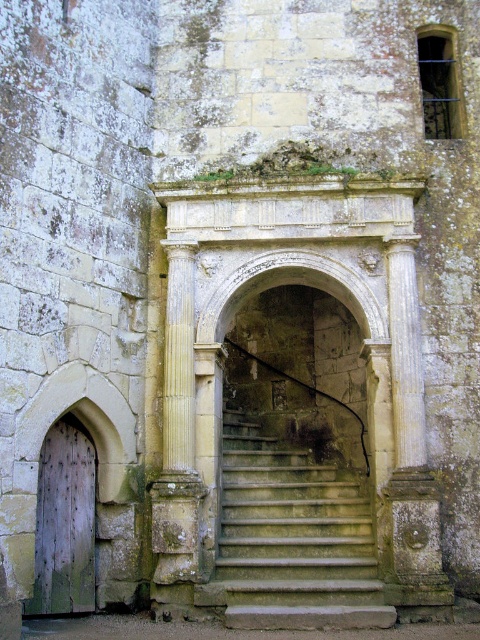
You are standing in front of the old stone building and want to enter through the weathered wood door at lower left. Which direction should you move relative to the stone steps at center?

You should move to the left relative to the stone steps at center because the weathered wood door at lower left is to the left of the stone steps at center.